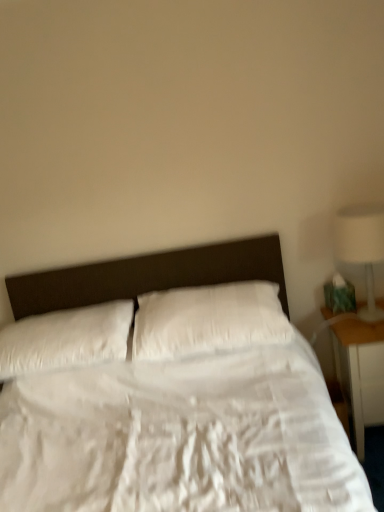
Question: Is white glossy lamp at right wider or thinner than white soft pillow at center, arranged as the second pillow when viewed from the left?

Choices:
 (A) thin
 (B) wide

Answer: (A)

Question: In terms of height, does white glossy lamp at right look taller or shorter compared to white soft pillow at center, marked as the first pillow in a right-to-left arrangement?

Choices:
 (A) tall
 (B) short

Answer: (A)

Question: Which object is positioned farthest from the white glossy lamp at right?

Choices:
 (A) white soft pillow at center, marked as the first pillow in a right-to-left arrangement
 (B) wooden nightstand at right
 (C) white soft pillow at left, placed as the 2th pillow when sorted from right to left

Answer: (C)

Question: Which object is the closest to the white glossy lamp at right?

Choices:
 (A) white soft pillow at left, which appears as the 1th pillow when viewed from the left
 (B) white soft pillow at center, arranged as the second pillow when viewed from the left
 (C) wooden nightstand at right

Answer: (C)